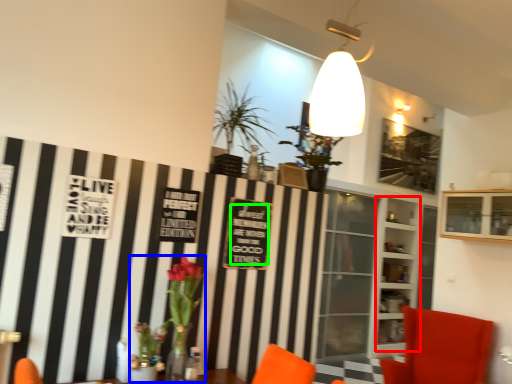
Question: Considering the real-world distances, which object is closest to shelf (highlighted by a red box)? floral arrangement (highlighted by a blue box) or writing (highlighted by a green box).

Choices:
 (A) floral arrangement
 (B) writing

Answer: (B)